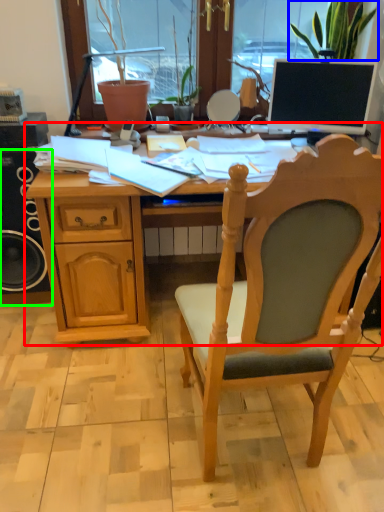
Question: Which object is the closest to the desk (highlighted by a red box)? Choose among these: houseplant (highlighted by a blue box) or loudspeaker (highlighted by a green box).

Choices:
 (A) houseplant
 (B) loudspeaker

Answer: (B)